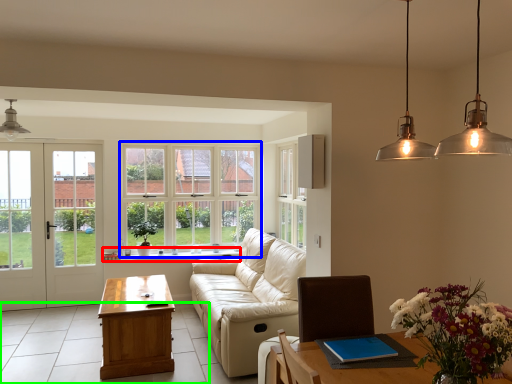
Question: Which object is positioned farthest from window sill (highlighted by a red box)? Select from window (highlighted by a blue box) and tile (highlighted by a green box).

Choices:
 (A) window
 (B) tile

Answer: (B)